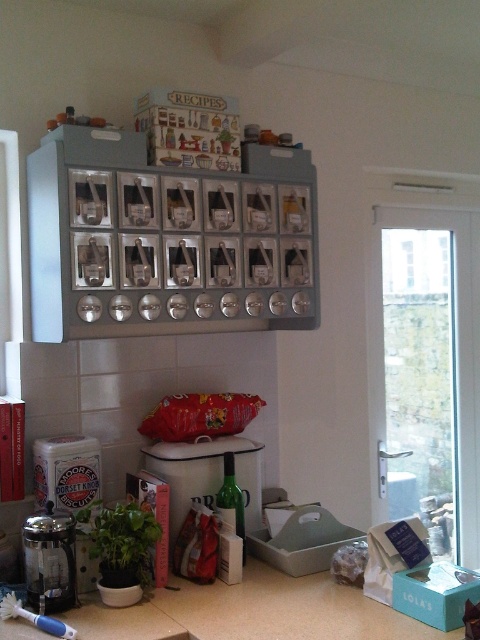
Question: Which object is the farthest from the matte white canister at center?

Choices:
 (A) beige laminate countertop at lower center
 (B) metallic glass coffee maker at lower left

Answer: (B)

Question: Is beige laminate countertop at lower center closer to camera compared to matte white canister at center?

Choices:
 (A) no
 (B) yes

Answer: (B)

Question: Can you confirm if beige laminate countertop at lower center is positioned to the left of matte white canister at center?

Choices:
 (A) yes
 (B) no

Answer: (B)

Question: Which of the following is the farthest from the observer?

Choices:
 (A) metallic glass coffee maker at lower left
 (B) beige laminate countertop at lower center

Answer: (A)

Question: Can you confirm if beige laminate countertop at lower center is smaller than metallic glass coffee maker at lower left?

Choices:
 (A) no
 (B) yes

Answer: (A)

Question: Which of the following is the farthest from the observer?

Choices:
 (A) metallic glass coffee maker at lower left
 (B) matte white canister at center
 (C) beige laminate countertop at lower center

Answer: (B)